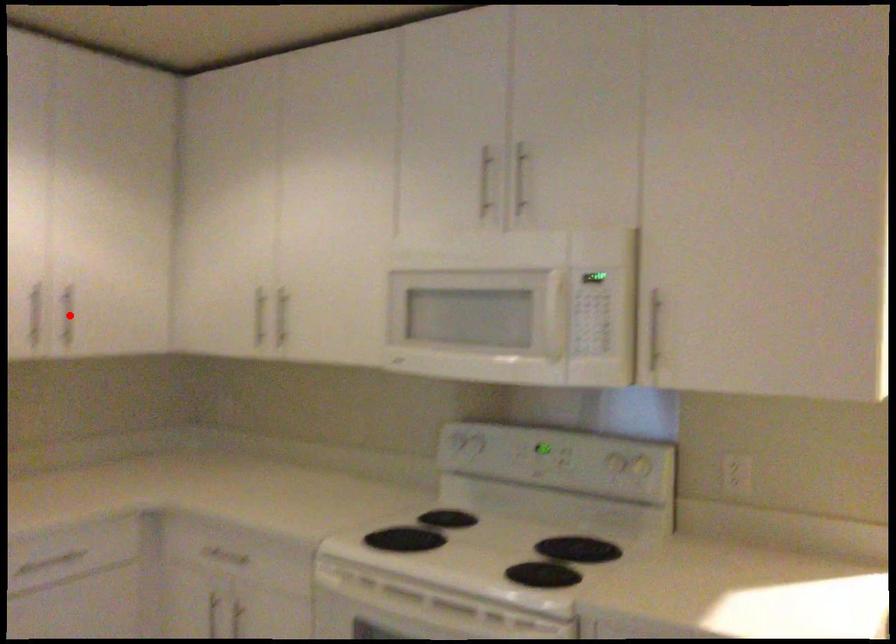
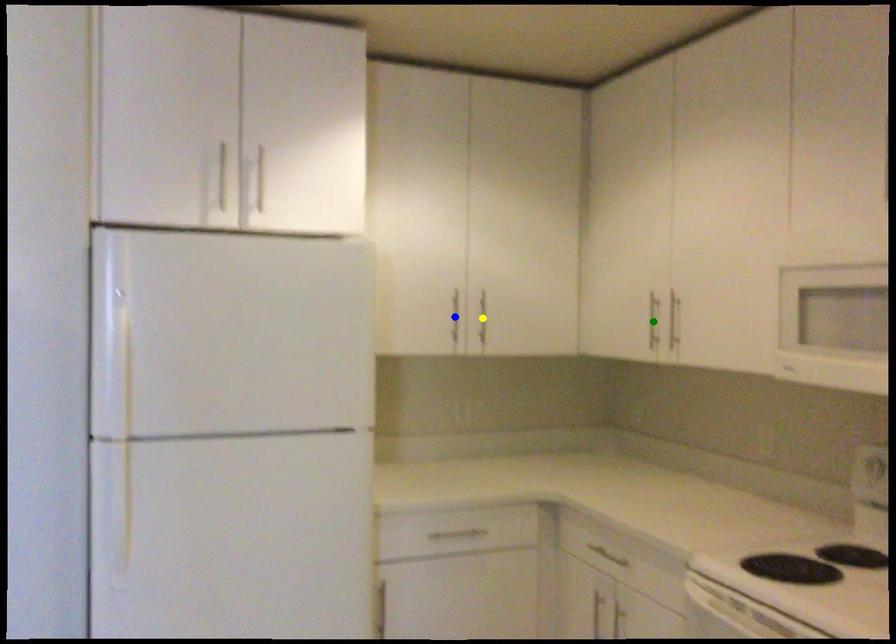
Question: I am providing you with two images of the same scene from different viewpoints. A red point is marked on the first image. You are given multiple points on the second image. Which spot in image 2 lines up with the point in image 1?

Choices:
 (A) blue point
 (B) yellow point
 (C) green point

Answer: (B)